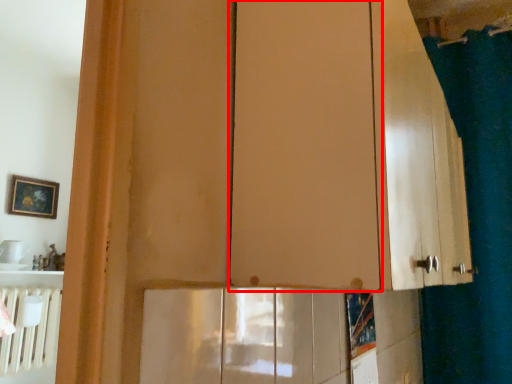
Question: From the image's perspective, where is screen door (annotated by the red box) located relative to shower curtain?

Choices:
 (A) below
 (B) above

Answer: (B)